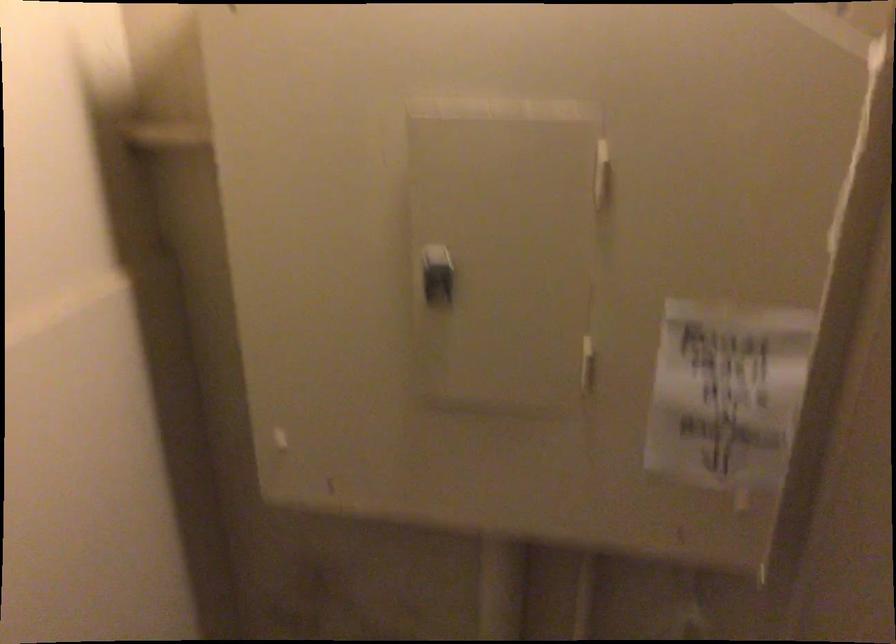
The width and height of the screenshot is (896, 644). Describe the element at coordinates (485, 281) in the screenshot. I see `the metal panel latch` at that location.